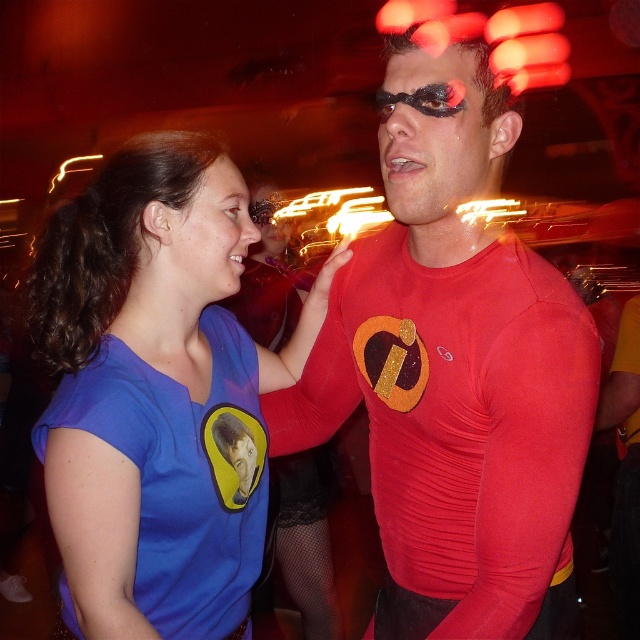
You are a photographer trying to capture a clear shot of both the blue fabric shirt at left and the matte red mask at center. Since you want both subjects in focus, which one should you adjust your camera focus on first?

You should focus on the matte red mask at center first because it is farther away from the viewer than the blue fabric shirt at left, ensuring depth of field covers both.

You are organizing a costume party and need to arrange two items on a display shelf. The blue fabric shirt at left and the matte red mask at center must be placed side by side. If the shelf has limited space, which item should be placed first to ensure both fit?

The blue fabric shirt at left is wider than the matte red mask at center, so place the narrower matte red mask at center first to accommodate the wider shirt next to it.